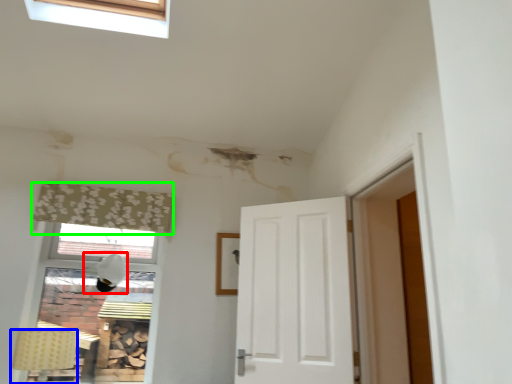
Question: Which object is the farthest from lamp (highlighted by a red box)? Choose among these: lamp (highlighted by a blue box) or curtain (highlighted by a green box).

Choices:
 (A) lamp
 (B) curtain

Answer: (A)